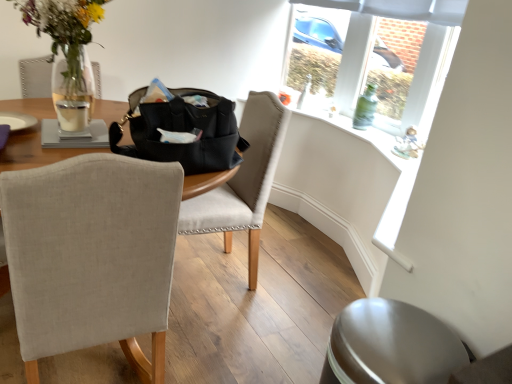
Question: Do you think translucent glass vase with flowers at upper left is within white matte candle at table left, or outside of it?

Choices:
 (A) outside
 (B) inside

Answer: (A)

Question: In terms of height, does translucent glass vase with flowers at upper left look taller or shorter compared to white matte candle at table left?

Choices:
 (A) short
 (B) tall

Answer: (B)

Question: Considering the real-world distances, which object is farthest from the clear glass vase at upper right?

Choices:
 (A) light beige fabric chair at center, arranged as the 2th chair when viewed from the front
 (B) beige fabric chair at left, the first chair viewed from the front
 (C) translucent glass vase with flowers at upper left
 (D) white matte candle at table left
 (E) metallic silver swivel chair at lower right

Answer: (B)

Question: Based on their relative distances, which object is farther from the translucent glass vase with flowers at upper left?

Choices:
 (A) metallic silver swivel chair at lower right
 (B) black leather handbag at center
 (C) beige fabric chair at left, the first chair viewed from the front
 (D) green glass bottle at upper right
 (E) white matte candle at table left

Answer: (D)